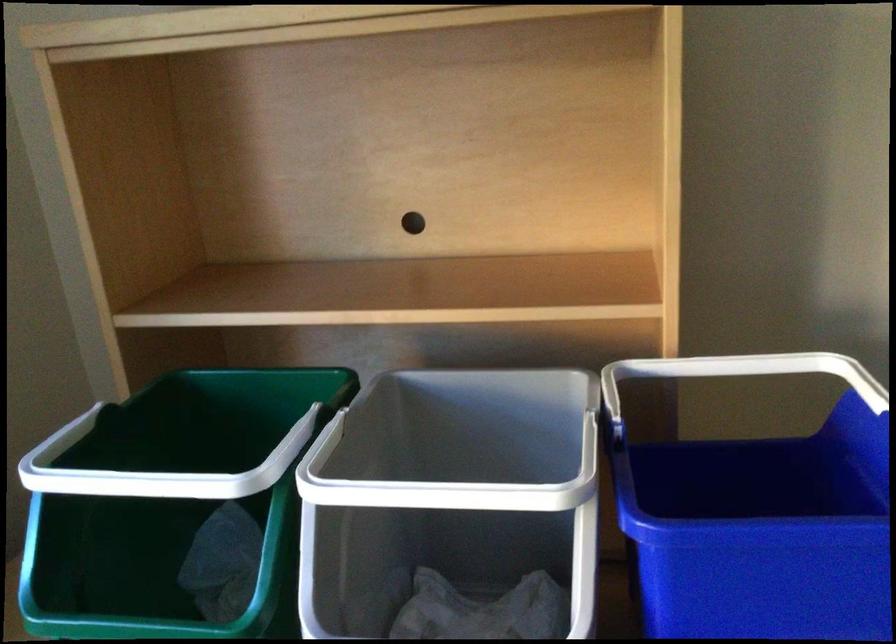
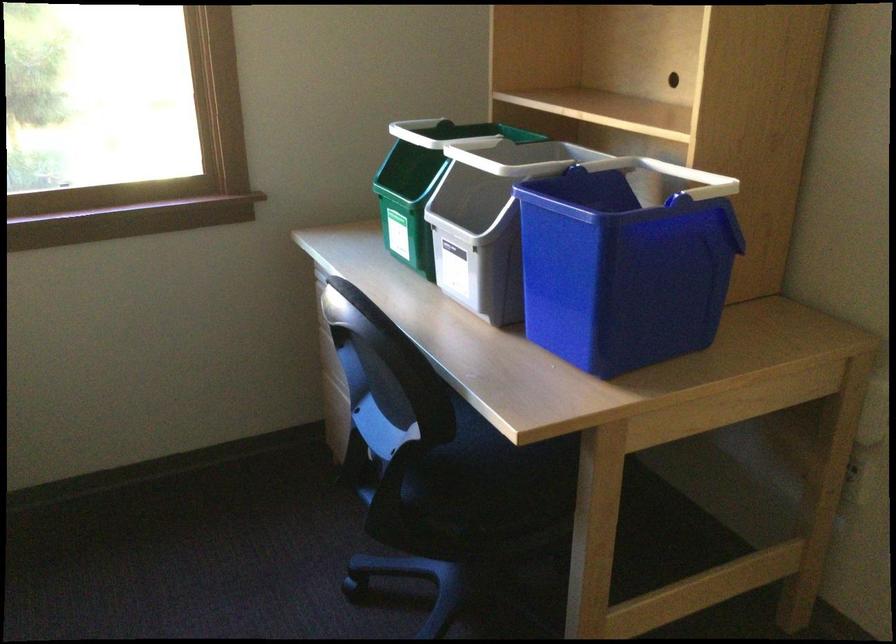
Where in the second image is the point corresponding to [116,552] from the first image?

(421, 184)